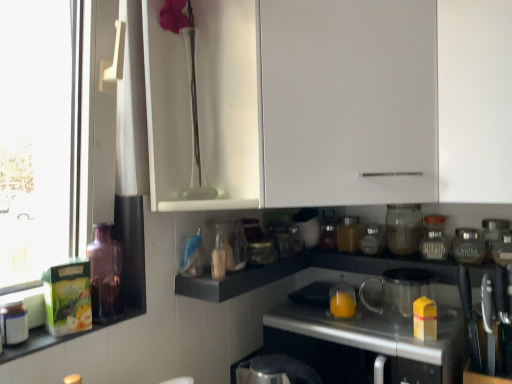
Locate an element on the screen. The width and height of the screenshot is (512, 384). blank space above matte glass jar at left (from a real-world perspective) is located at coordinates (53, 332).